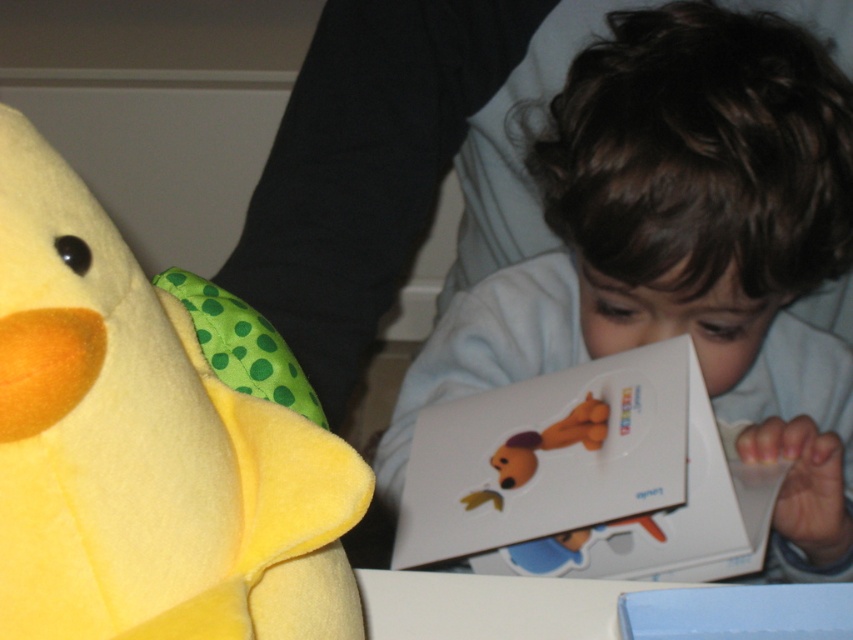
I want to click on smooth white shirt at center, so click(683, 250).

Which is more to the left, smooth white shirt at center or yellow felt plush toy at left?

yellow felt plush toy at left is more to the left.

Image resolution: width=853 pixels, height=640 pixels. I want to click on smooth white shirt at center, so click(683, 250).

At what (x,y) coordinates should I click in order to perform the action: click on smooth white shirt at center. Please return your answer as a coordinate pair (x, y). Looking at the image, I should click on (683, 250).